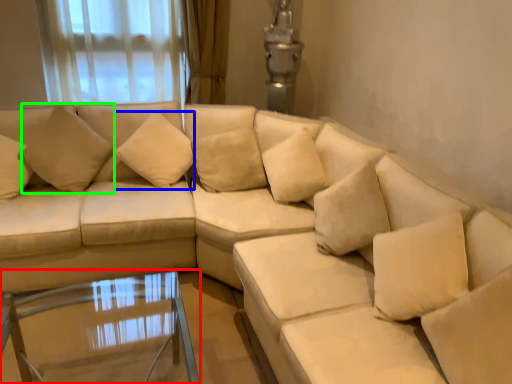
Question: Which is farther away from table (highlighted by a red box)? pillow (highlighted by a blue box) or pillow (highlighted by a green box)?

Choices:
 (A) pillow
 (B) pillow

Answer: (A)